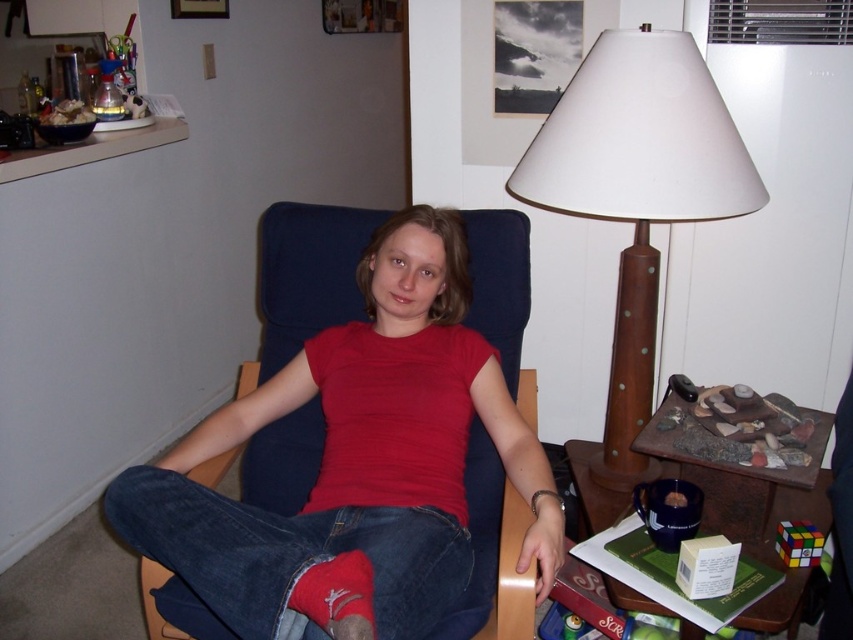
Who is positioned more to the right, denim at center or red cotton sock at lower left?

Positioned to the right is red cotton sock at lower left.

How far apart are denim at center and red cotton sock at lower left?

The distance of denim at center from red cotton sock at lower left is 19.11 centimeters.

Who is more distant from viewer, (247, 529) or (346, 561)?

The point (247, 529) is more distant.

You are a GUI agent. You are given a task and a screenshot of the screen. Output one action in this format:
    pyautogui.click(x=<x>, y=<y>)
    Task: Click on the denim at center
    The height and width of the screenshot is (640, 853).
    Given the screenshot: What is the action you would take?
    pyautogui.click(x=286, y=554)

Does brown polished wood lamp at upper right have a smaller size compared to denim at center?

No.

Locate an element on the screen. The width and height of the screenshot is (853, 640). brown polished wood lamp at upper right is located at coordinates 637,193.

Which is in front, point (434, 477) or point (618, 324)?

Point (434, 477) is in front.

Locate an element on the screen. matte red shirt at center is located at coordinates (357, 456).